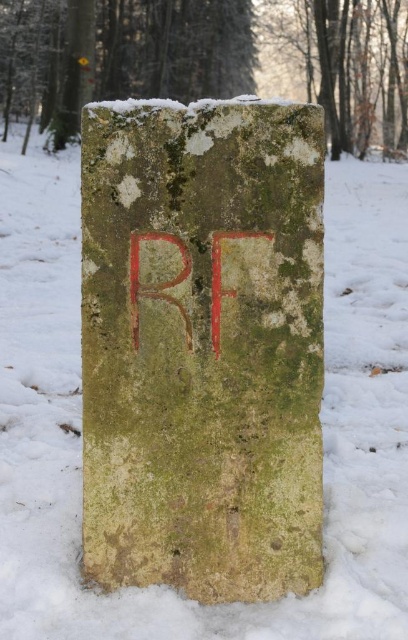
Question: Which of the following is the farthest from the observer?

Choices:
 (A) (181, 588)
 (B) (59, 97)

Answer: (B)

Question: Considering the real-world distances, which object is farthest from the red stone rf at center?

Choices:
 (A) green mossy stone at upper left
 (B) green mossy stone at center

Answer: (A)

Question: Which object appears closest to the camera in this image?

Choices:
 (A) green mossy stone at center
 (B) red stone rf at center
 (C) green mossy stone at upper left

Answer: (A)

Question: Does green mossy stone at center lie behind green mossy stone at upper left?

Choices:
 (A) no
 (B) yes

Answer: (A)

Question: Observing the image, what is the correct spatial positioning of green mossy stone at center in reference to red stone rf at center?

Choices:
 (A) left
 (B) right

Answer: (B)

Question: Is red stone rf at center smaller than green mossy stone at upper left?

Choices:
 (A) yes
 (B) no

Answer: (A)